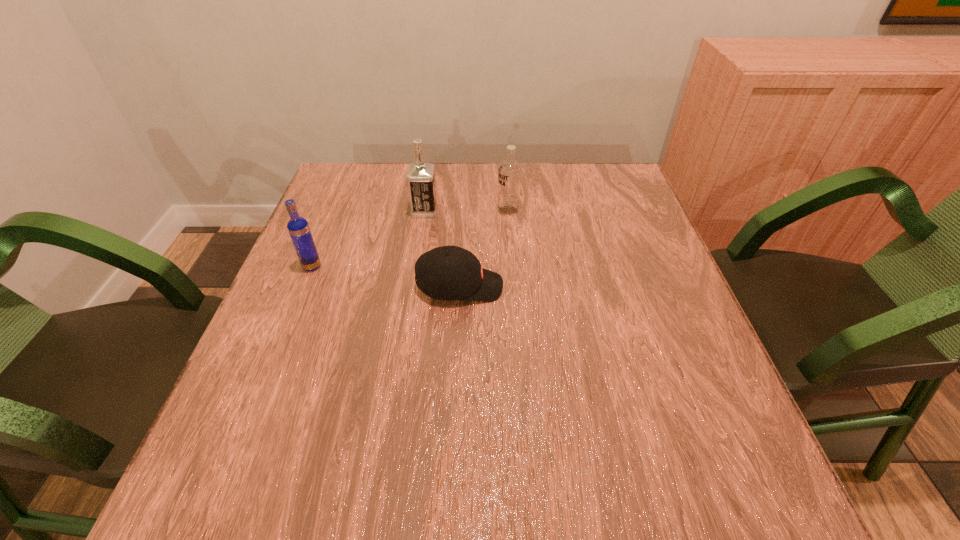
I want to click on blank space located 0.380m with a logo on the front of the baseball cap, so click(x=679, y=287).

I want to click on object that is at the left edge, so click(298, 227).

Locate an element on the screen. The width and height of the screenshot is (960, 540). vacant space at the far edge is located at coordinates (553, 173).

In the image, there is a desktop. Where is `free space at the near edge`? The height and width of the screenshot is (540, 960). free space at the near edge is located at coordinates (530, 513).

Identify the location of free space at the left edge. The width and height of the screenshot is (960, 540). (300, 356).

I want to click on vacant space at the right edge of the desktop, so click(x=649, y=411).

At what (x,y) coordinates should I click in order to perform the action: click on free space at the far left corner. Please return your answer as a coordinate pair (x, y). The width and height of the screenshot is (960, 540). Looking at the image, I should click on (363, 167).

In the image, there is a desktop. Where is `vacant region at the far right corner`? The width and height of the screenshot is (960, 540). vacant region at the far right corner is located at coordinates (620, 181).

The height and width of the screenshot is (540, 960). I want to click on free space between the second vodka from left to right and the leftmost vodka, so click(369, 239).

At what (x,y) coordinates should I click in order to perform the action: click on free spot between the shortest object and the leftmost vodka. Please return your answer as a coordinate pair (x, y). This screenshot has width=960, height=540. Looking at the image, I should click on (386, 276).